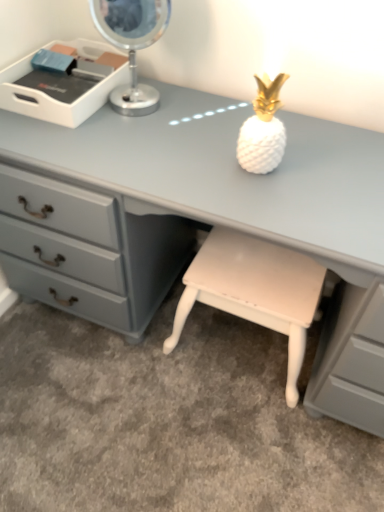
Question: Is matte gray desk at center taller or shorter than metallic silver table lamp at upper left?

Choices:
 (A) short
 (B) tall

Answer: (B)

Question: From a real-world perspective, is matte gray desk at center positioned above or below metallic silver table lamp at upper left?

Choices:
 (A) above
 (B) below

Answer: (B)

Question: Which of these objects is positioned closest to the metallic silver table lamp at upper left?

Choices:
 (A) white plastic tray at upper left
 (B) matte gray desk at center
 (C) white glossy stool at lower center

Answer: (A)

Question: Based on their relative distances, which object is nearer to the metallic silver table lamp at upper left?

Choices:
 (A) white glossy stool at lower center
 (B) matte gray desk at center
 (C) white plastic tray at upper left

Answer: (C)